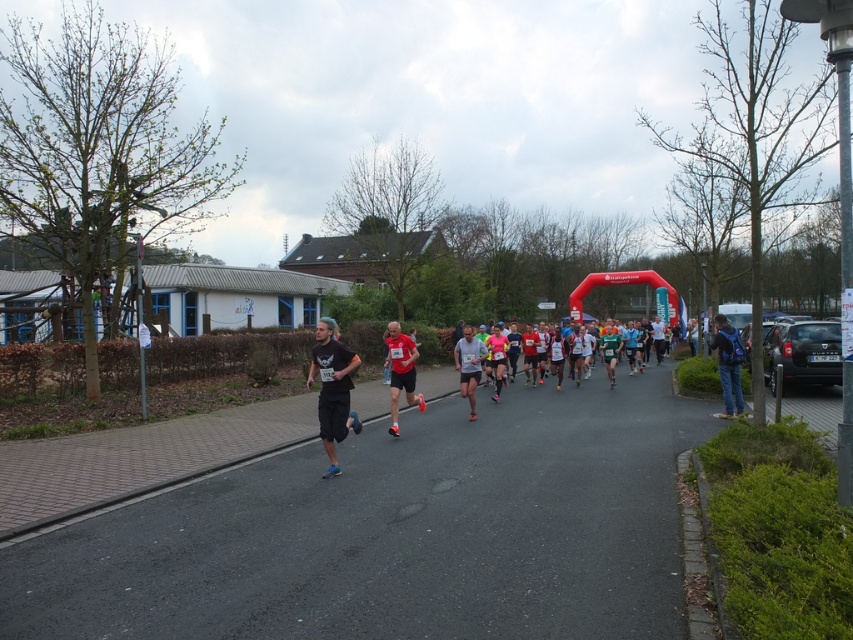
Who is lower down, red running shoe at center or gray fabric shirt at center?

gray fabric shirt at center is lower down.

Does red running shoe at center have a greater width compared to gray fabric shirt at center?

Yes, red running shoe at center is wider than gray fabric shirt at center.

Which is behind, point (405, 374) or point (471, 364)?

The point (471, 364) is behind.

Where is `red running shoe at center`? red running shoe at center is located at coordinates (399, 371).

Can you confirm if black matte shorts at center is smaller than gray fabric shirt at center?

No.

Which is in front, point (318, 396) or point (473, 356)?

Point (318, 396) is more forward.

The height and width of the screenshot is (640, 853). I want to click on black matte shorts at center, so click(x=332, y=388).

Is point (317, 330) in front of point (389, 364)?

Yes.

Consider the image. Is black matte shorts at center thinner than red running shoe at center?

Yes.

Does point (334, 474) come closer to viewer compared to point (405, 362)?

That is True.

Locate an element on the screen. This screenshot has height=640, width=853. black matte shorts at center is located at coordinates (332, 388).